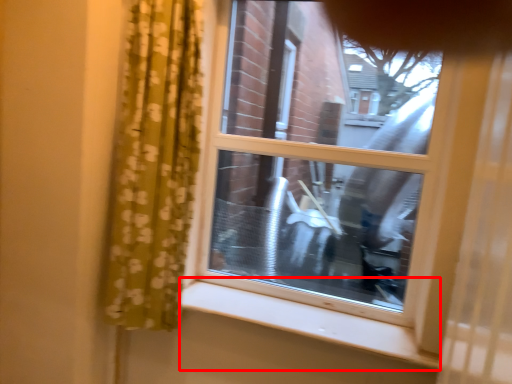
Question: Where is window sill (annotated by the red box) located in relation to window in the image?

Choices:
 (A) right
 (B) left

Answer: (B)